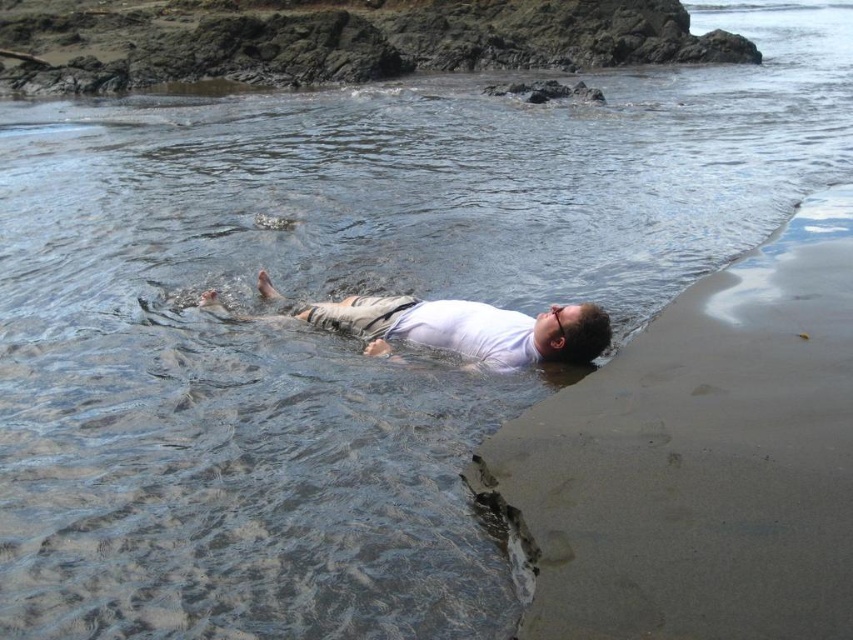
Is the position of sandy shore at lower right less distant than that of white matte shirt at center?

Yes, sandy shore at lower right is in front of white matte shirt at center.

Between sandy shore at lower right and white matte shirt at center, which one appears on the left side from the viewer's perspective?

From the viewer's perspective, white matte shirt at center appears more on the left side.

Where is `sandy shore at lower right`? This screenshot has height=640, width=853. sandy shore at lower right is located at coordinates (699, 460).